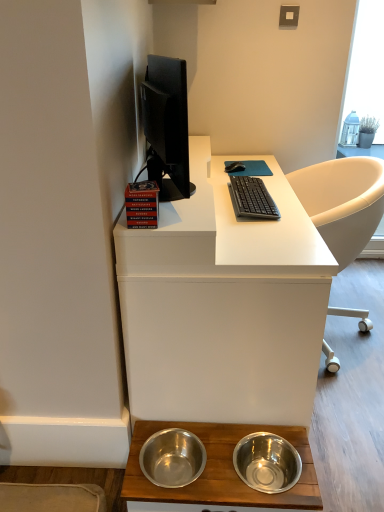
Question: Does black rubber mouse at center lie in front of stainless steel bowls at lower center, which is the second desk from top to bottom?

Choices:
 (A) yes
 (B) no

Answer: (B)

Question: Is black rubber mouse at center in contact with stainless steel bowls at lower center, marked as the 1th desk in a bottom-to-top arrangement?

Choices:
 (A) yes
 (B) no

Answer: (B)

Question: Considering the relative positions of black rubber mouse at center and stainless steel bowls at lower center, which is the second desk from top to bottom, in the image provided, is black rubber mouse at center to the right of stainless steel bowls at lower center, which is the second desk from top to bottom, from the viewer's perspective?

Choices:
 (A) yes
 (B) no

Answer: (A)

Question: Is black rubber mouse at center located outside stainless steel bowls at lower center, which is the second desk from top to bottom?

Choices:
 (A) no
 (B) yes

Answer: (B)

Question: Is black rubber mouse at center turned away from stainless steel bowls at lower center, which is the second desk from top to bottom?

Choices:
 (A) no
 (B) yes

Answer: (A)

Question: Are black rubber mouse at center and stainless steel bowls at lower center, marked as the 1th desk in a bottom-to-top arrangement, far apart?

Choices:
 (A) no
 (B) yes

Answer: (B)

Question: From a real-world perspective, is white matte desk at center, which appears as the first desk when viewed from the top, beneath black rubber mouse at center?

Choices:
 (A) no
 (B) yes

Answer: (B)

Question: From the image's perspective, is white matte desk at center, which appears as the first desk when viewed from the top, beneath black rubber mouse at center?

Choices:
 (A) yes
 (B) no

Answer: (A)

Question: Could you tell me if white matte desk at center, arranged as the 2th desk when ordered from the bottom, is facing black rubber mouse at center?

Choices:
 (A) no
 (B) yes

Answer: (B)

Question: Is white matte desk at center, which appears as the first desk when viewed from the top, positioned beyond the bounds of black rubber mouse at center?

Choices:
 (A) yes
 (B) no

Answer: (A)

Question: Considering the relative sizes of white matte desk at center, arranged as the 2th desk when ordered from the bottom, and black rubber mouse at center in the image provided, is white matte desk at center, arranged as the 2th desk when ordered from the bottom, smaller than black rubber mouse at center?

Choices:
 (A) no
 (B) yes

Answer: (A)

Question: Is the position of white matte desk at center, arranged as the 2th desk when ordered from the bottom, less distant than that of black rubber mouse at center?

Choices:
 (A) yes
 (B) no

Answer: (A)

Question: Considering the relative sizes of black plastic keyboard at center and black rubber mouse at center in the image provided, is black plastic keyboard at center thinner than black rubber mouse at center?

Choices:
 (A) yes
 (B) no

Answer: (B)